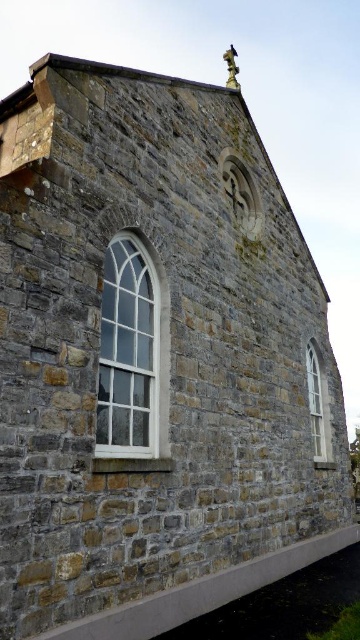
You are an architect inspecting the stone building. You notice two windows, the clear glass window at center and the white glass window at lower right. Which window is located more to the left side of the building?

The clear glass window at center is positioned on the left side of white glass window at lower right, so the clear glass window at center is more to the left.